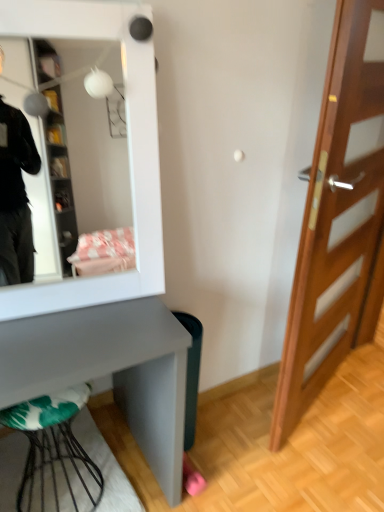
Question: Is white glossy mirror at upper left in front of wooden door at right?

Choices:
 (A) no
 (B) yes

Answer: (B)

Question: Is white glossy mirror at upper left taller than wooden door at right?

Choices:
 (A) yes
 (B) no

Answer: (B)

Question: Would you say wooden door at right is part of white glossy mirror at upper left's contents?

Choices:
 (A) yes
 (B) no

Answer: (B)

Question: Is white glossy mirror at upper left further to the viewer compared to wooden door at right?

Choices:
 (A) no
 (B) yes

Answer: (A)

Question: Is white glossy mirror at upper left wider than wooden door at right?

Choices:
 (A) yes
 (B) no

Answer: (A)

Question: Looking at the image, does metallic wire stool at lower left seem bigger or smaller compared to white glossy mirror at upper left?

Choices:
 (A) small
 (B) big

Answer: (A)

Question: From the image's perspective, is metallic wire stool at lower left located above or below white glossy mirror at upper left?

Choices:
 (A) above
 (B) below

Answer: (B)

Question: Would you say metallic wire stool at lower left is to the left or to the right of white glossy mirror at upper left in the picture?

Choices:
 (A) right
 (B) left

Answer: (B)

Question: In terms of height, does metallic wire stool at lower left look taller or shorter compared to white glossy mirror at upper left?

Choices:
 (A) tall
 (B) short

Answer: (B)

Question: Considering the positions of point pos(16,403) and point pos(349,273), is point pos(16,403) closer or farther from the camera than point pos(349,273)?

Choices:
 (A) closer
 (B) farther

Answer: (A)

Question: Is metallic wire stool at lower left taller or shorter than wooden door at right?

Choices:
 (A) tall
 (B) short

Answer: (B)

Question: Looking at the image, does metallic wire stool at lower left seem bigger or smaller compared to wooden door at right?

Choices:
 (A) big
 (B) small

Answer: (B)

Question: Considering the relative positions of metallic wire stool at lower left and wooden door at right in the image provided, is metallic wire stool at lower left to the left or to the right of wooden door at right?

Choices:
 (A) left
 (B) right

Answer: (A)

Question: In terms of width, does white glossy mirror at upper left look wider or thinner when compared to wooden door at right?

Choices:
 (A) thin
 (B) wide

Answer: (B)

Question: Is white glossy mirror at upper left inside the boundaries of wooden door at right, or outside?

Choices:
 (A) inside
 (B) outside

Answer: (B)